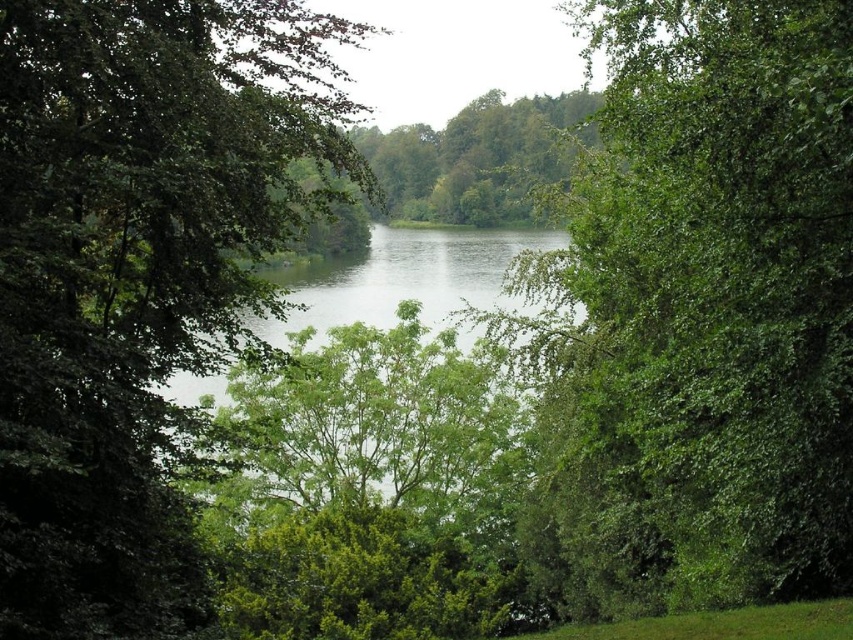
You are standing in the middle of the forest looking at the green leafy tree at center and the green leafy tree at left. Which tree is closer to the ground?

The green leafy tree at center is closer to the ground because it is positioned below the green leafy tree at left.

You are standing at the center of the image and see a point marked at coordinates (700, 314). Based on the scene description, can you determine what object this point is located on?

The point at coordinates (700, 314) is located on the green leafy tree at center.